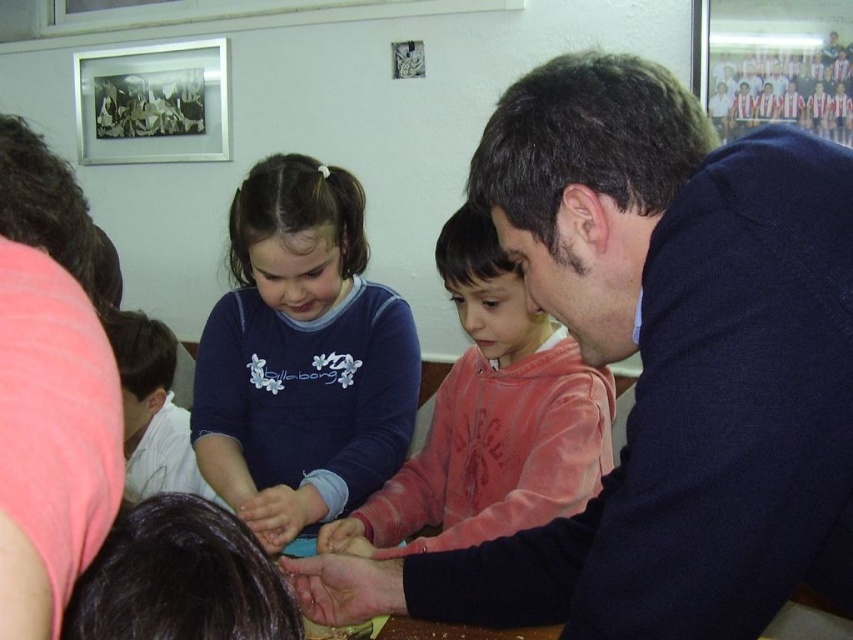
You are a photographer trying to capture a group photo of the dark blue sweater at center and the pink fabric shirt at upper left. Which subject should you position to your left to frame them properly?

The pink fabric shirt at upper left should be positioned to your left since the dark blue sweater at center is already on its right side.

You are standing in front of the table where the children and adult are working. You notice two points marked on the table surface. The first point is at coordinates point (541, 456) and the second is at point (16, 385). Which point is closer to you?

Point (16, 385) is closer to you because it is less further to the viewer than point (541, 456).